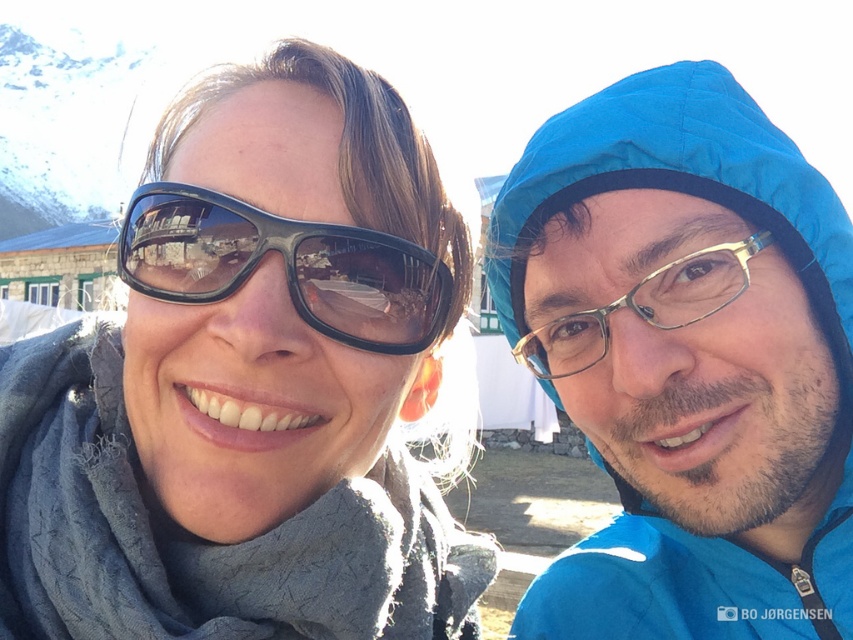
How far apart are matte black sunglasses at upper left and blue quilted raincoat at upper right?

matte black sunglasses at upper left and blue quilted raincoat at upper right are 31.40 feet apart from each other.

In order to click on matte black sunglasses at upper left in this screenshot , I will do `click(248, 385)`.

The width and height of the screenshot is (853, 640). I want to click on matte black sunglasses at upper left, so click(248, 385).

The width and height of the screenshot is (853, 640). In order to click on matte black sunglasses at upper left in this screenshot , I will do (x=248, y=385).

Is black matte goggles at left to the right of gold-framed glasses at right from the viewer's perspective?

In fact, black matte goggles at left is to the left of gold-framed glasses at right.

Is the position of black matte goggles at left less distant than that of gold-framed glasses at right?

Yes, it is.

Describe the element at coordinates (285, 266) in the screenshot. The width and height of the screenshot is (853, 640). I see `black matte goggles at left` at that location.

Find the location of a particular element. This screenshot has height=640, width=853. black matte goggles at left is located at coordinates (285, 266).

Which of these two, matte black sunglasses at upper left or black matte goggles at left, stands taller?

Standing taller between the two is matte black sunglasses at upper left.

Does matte black sunglasses at upper left have a lesser height compared to black matte goggles at left?

In fact, matte black sunglasses at upper left may be taller than black matte goggles at left.

This screenshot has width=853, height=640. I want to click on matte black sunglasses at upper left, so click(248, 385).

Image resolution: width=853 pixels, height=640 pixels. Find the location of `matte black sunglasses at upper left`. matte black sunglasses at upper left is located at coordinates (248, 385).